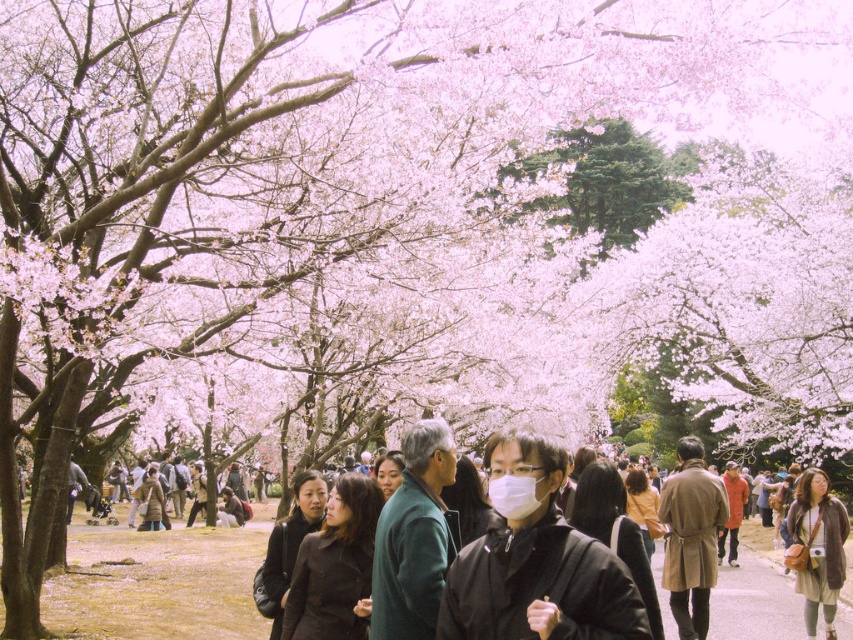
Question: Does green matte jacket at center appear under tan leather coat at center?

Choices:
 (A) yes
 (B) no

Answer: (B)

Question: Which of these objects is positioned farthest from the green matte jacket at center?

Choices:
 (A) brown leather jacket at lower right
 (B) tan leather coat at center
 (C) matte black jacket at center

Answer: (A)

Question: Which point is farther to the camera?

Choices:
 (A) green matte jacket at center
 (B) matte black jacket at center

Answer: (A)

Question: Does green matte jacket at center have a smaller size compared to brown leather jacket at lower right?

Choices:
 (A) no
 (B) yes

Answer: (B)

Question: Does green matte jacket at center appear on the right side of tan leather coat at center?

Choices:
 (A) no
 (B) yes

Answer: (A)

Question: Based on their relative distances, which object is nearer to the green matte jacket at center?

Choices:
 (A) matte black jacket at center
 (B) brown leather jacket at lower right
 (C) tan leather coat at center

Answer: (A)